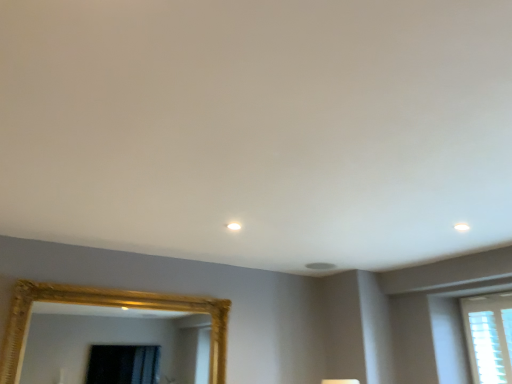
Question: From a real-world perspective, is white textured blinds at right above or below gold textured mirror at lower left?

Choices:
 (A) above
 (B) below

Answer: (A)

Question: From the image's perspective, is white textured blinds at right above or below gold textured mirror at lower left?

Choices:
 (A) above
 (B) below

Answer: (B)

Question: Visually, is white textured blinds at right positioned to the left or to the right of gold textured mirror at lower left?

Choices:
 (A) left
 (B) right

Answer: (B)

Question: Is gold textured mirror at lower left taller or shorter than white textured blinds at right?

Choices:
 (A) short
 (B) tall

Answer: (A)

Question: Is gold textured mirror at lower left in front of or behind white textured blinds at right in the image?

Choices:
 (A) front
 (B) behind

Answer: (A)

Question: Is gold textured mirror at lower left inside or outside of white textured blinds at right?

Choices:
 (A) outside
 (B) inside

Answer: (A)

Question: In terms of width, does gold textured mirror at lower left look wider or thinner when compared to white textured blinds at right?

Choices:
 (A) thin
 (B) wide

Answer: (B)